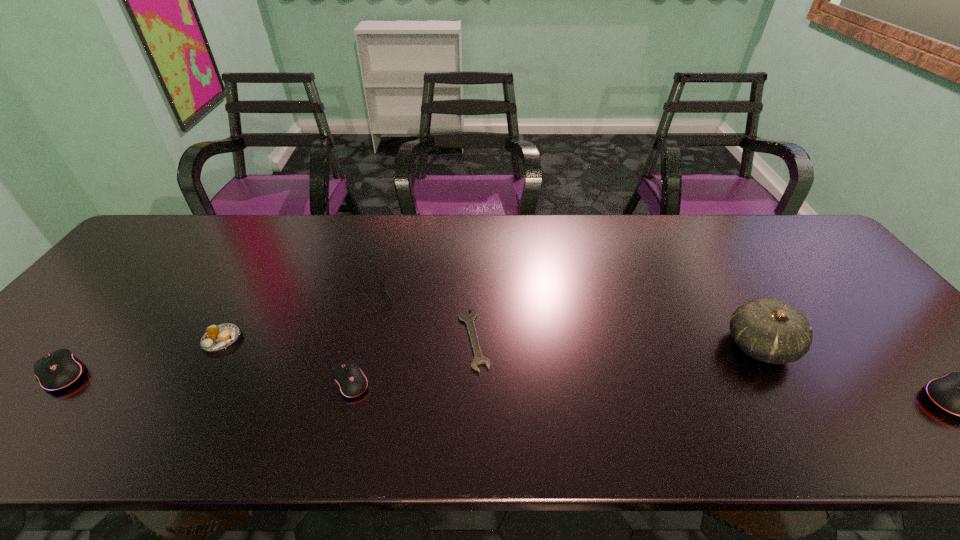
Image resolution: width=960 pixels, height=540 pixels. In order to click on object that stands as the third closest to the gourd in this screenshot , I will do `click(388, 296)`.

Select which computer mouse appears as the second closest to the tallest computer mouse. Please provide its 2D coordinates. Your answer should be formatted as a tuple, i.e. [(x, y)], where the tuple contains the x and y coordinates of a point satisfying the conditions above.

[(58, 370)]

Identify the location of computer mouse that can be found as the closest to the rightmost object. (351, 381).

Where is `vacant point that satisfies the following two spatial constraints: 1. on the back side of the leftmost object; 2. on the right side of the second object from right to left`? The height and width of the screenshot is (540, 960). vacant point that satisfies the following two spatial constraints: 1. on the back side of the leftmost object; 2. on the right side of the second object from right to left is located at coordinates (x=85, y=346).

This screenshot has width=960, height=540. I want to click on free space that satisfies the following two spatial constraints: 1. with the lenses facing outward on the spectacles; 2. on the right side of the gourd, so click(x=356, y=346).